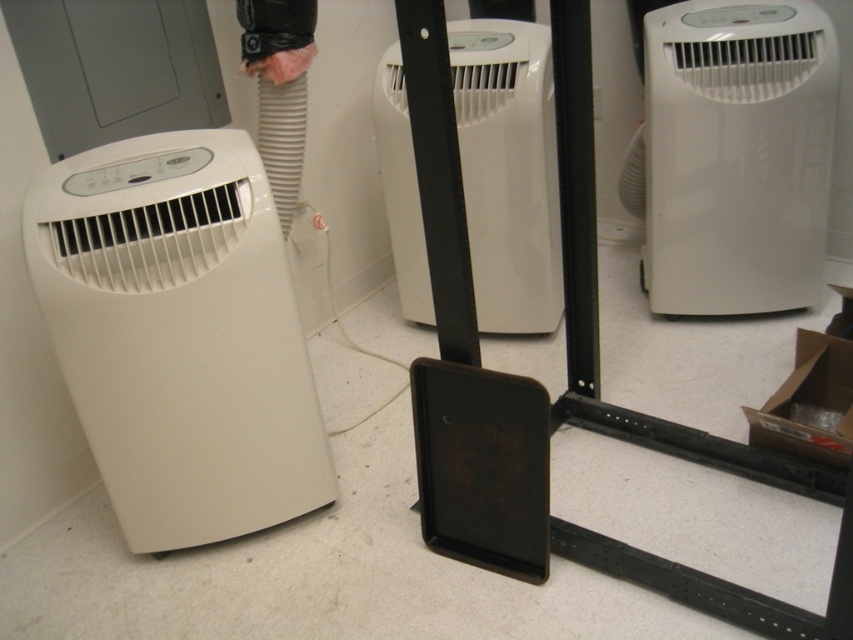
Question: Can you confirm if white glossy air conditioner at center is positioned below white plastic air conditioner at center?

Choices:
 (A) no
 (B) yes

Answer: (A)

Question: Which point is farther to the camera?

Choices:
 (A) white matte portable air conditioner at left
 (B) white glossy air conditioner at center
 (C) white plastic air conditioner at center

Answer: (C)

Question: Which point appears farthest from the camera in this image?

Choices:
 (A) (740, 26)
 (B) (242, 136)
 (C) (517, 44)

Answer: (C)

Question: Among these objects, which one is farthest from the camera?

Choices:
 (A) white glossy air conditioner at center
 (B) white plastic air conditioner at center

Answer: (B)

Question: Can you confirm if white matte portable air conditioner at left is positioned to the right of white glossy air conditioner at center?

Choices:
 (A) no
 (B) yes

Answer: (A)

Question: Can you confirm if white matte portable air conditioner at left is positioned above white plastic air conditioner at center?

Choices:
 (A) no
 (B) yes

Answer: (A)